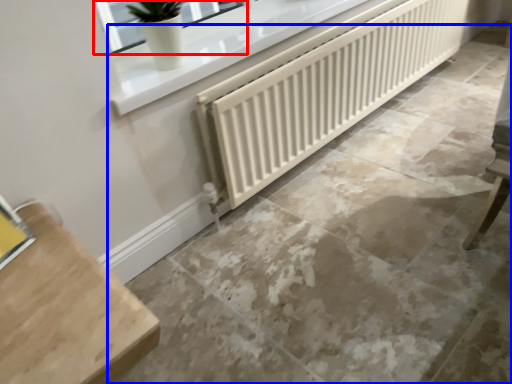
Question: Which object appears farthest to the camera in this image, window (highlighted by a red box) or concrete (highlighted by a blue box)?

Choices:
 (A) window
 (B) concrete

Answer: (A)